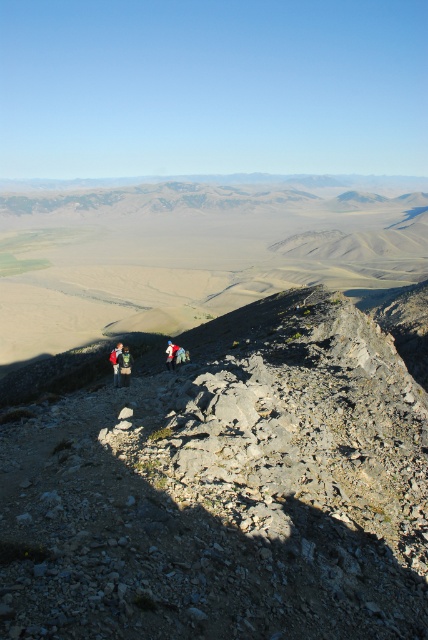
Image resolution: width=428 pixels, height=640 pixels. What do you see at coordinates (124, 365) in the screenshot?
I see `camouflage fabric backpack at lower left` at bounding box center [124, 365].

Can you confirm if camouflage fabric backpack at lower left is positioned to the right of blue fabric jacket at center?

Incorrect, camouflage fabric backpack at lower left is not on the right side of blue fabric jacket at center.

What do you see at coordinates (124, 365) in the screenshot?
I see `camouflage fabric backpack at lower left` at bounding box center [124, 365].

Where is `camouflage fabric backpack at lower left`? The width and height of the screenshot is (428, 640). camouflage fabric backpack at lower left is located at coordinates (124, 365).

Is camouflage fabric backpack at lower left further to the viewer compared to red backpack at center?

No, it is in front of red backpack at center.

Is point (124, 380) behind point (116, 365)?

That is False.

Describe the element at coordinates (124, 365) in the screenshot. I see `camouflage fabric backpack at lower left` at that location.

In order to click on camouflage fabric backpack at lower left in this screenshot , I will do `click(124, 365)`.

Is red backpack at center behind blue fabric jacket at center?

No, red backpack at center is closer to the viewer.

Can you confirm if red backpack at center is positioned to the right of blue fabric jacket at center?

Incorrect, red backpack at center is not on the right side of blue fabric jacket at center.

Does point (118, 353) come in front of point (168, 365)?

Yes, point (118, 353) is closer to viewer.

Locate an element on the screen. Image resolution: width=428 pixels, height=640 pixels. red backpack at center is located at coordinates (115, 364).